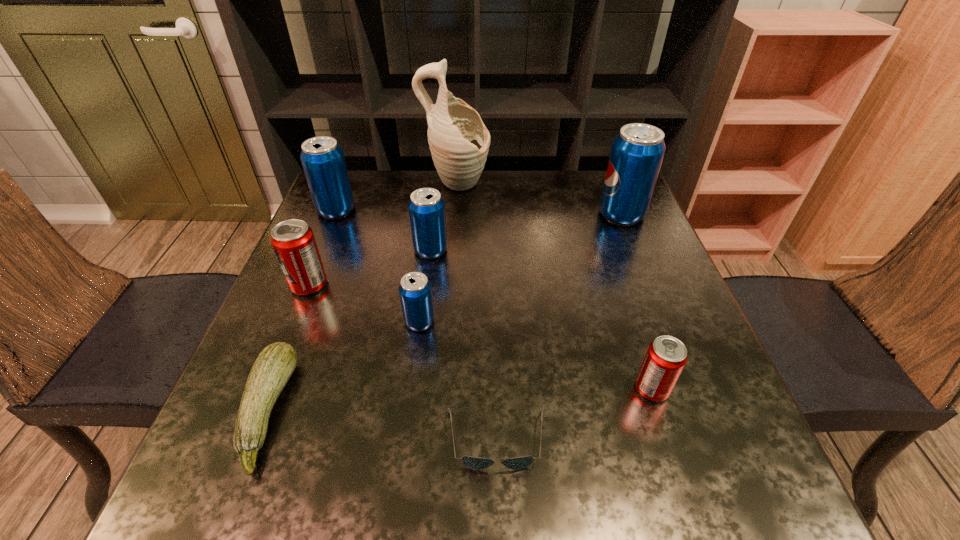
Where is `the nearest blue pop soda`? This screenshot has height=540, width=960. the nearest blue pop soda is located at coordinates (x=415, y=292).

Locate an element on the screen. This screenshot has width=960, height=540. the right red soda can is located at coordinates (666, 356).

Locate an element on the screen. Image resolution: width=960 pixels, height=540 pixels. the smaller red soda can is located at coordinates (666, 356).

I want to click on zucchini, so click(273, 367).

Image resolution: width=960 pixels, height=540 pixels. I want to click on green zucchini, so click(273, 367).

I want to click on black sunglasses, so click(x=476, y=463).

Where is `sunglasses`? sunglasses is located at coordinates (476, 463).

The image size is (960, 540). I want to click on vacant area located at the spout of the pitcher, so coord(568,186).

Where is `free space located 0.150m on the left of the biggest blue pop soda`? free space located 0.150m on the left of the biggest blue pop soda is located at coordinates (542, 214).

Locate an element on the screen. The height and width of the screenshot is (540, 960). free point located on the front of the second biggest blue pop soda is located at coordinates coord(324,240).